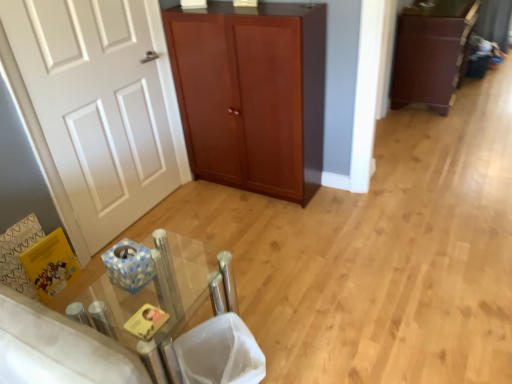
Question: Is white matte door at left next to mahogany wood cupboard at center and touching it?

Choices:
 (A) no
 (B) yes

Answer: (A)

Question: Is white matte door at left not close to mahogany wood cupboard at center?

Choices:
 (A) no
 (B) yes

Answer: (A)

Question: Does white matte door at left have a larger size compared to mahogany wood cupboard at center?

Choices:
 (A) yes
 (B) no

Answer: (B)

Question: From a real-world perspective, does white matte door at left sit lower than mahogany wood cupboard at center?

Choices:
 (A) yes
 (B) no

Answer: (B)

Question: Is white matte door at left wider than mahogany wood cupboard at center?

Choices:
 (A) yes
 (B) no

Answer: (B)

Question: In the image, is dark brown wood cabinet at right positioned in front of or behind clear glass table at center?

Choices:
 (A) behind
 (B) front

Answer: (A)

Question: From the image's perspective, is dark brown wood cabinet at right located above or below clear glass table at center?

Choices:
 (A) below
 (B) above

Answer: (B)

Question: Based on their positions, is dark brown wood cabinet at right located to the left or right of clear glass table at center?

Choices:
 (A) left
 (B) right

Answer: (B)

Question: Is point (441, 11) closer or farther from the camera than point (112, 360)?

Choices:
 (A) closer
 (B) farther

Answer: (B)

Question: In the image, is white matte door at left positioned in front of or behind white mesh laundry basket at lower center?

Choices:
 (A) behind
 (B) front

Answer: (A)

Question: From a real-world perspective, is white matte door at left above or below white mesh laundry basket at lower center?

Choices:
 (A) above
 (B) below

Answer: (A)

Question: Would you say white matte door at left is to the left or to the right of white mesh laundry basket at lower center in the picture?

Choices:
 (A) left
 (B) right

Answer: (A)

Question: From the image's perspective, is white matte door at left above or below white mesh laundry basket at lower center?

Choices:
 (A) above
 (B) below

Answer: (A)

Question: Is point (161, 369) positioned closer to the camera than point (438, 79)?

Choices:
 (A) farther
 (B) closer

Answer: (B)

Question: Visually, is clear glass table at center positioned to the left or to the right of dark brown wood cabinet at right?

Choices:
 (A) right
 (B) left

Answer: (B)